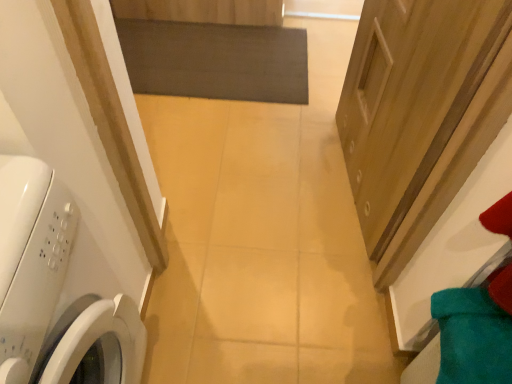
Question: From a real-world perspective, is dark gray matte mat at center below wooden door at right?

Choices:
 (A) yes
 (B) no

Answer: (A)

Question: From the image's perspective, does dark gray matte mat at center appear higher than wooden door at right?

Choices:
 (A) no
 (B) yes

Answer: (B)

Question: Considering the relative sizes of dark gray matte mat at center and wooden door at right in the image provided, is dark gray matte mat at center thinner than wooden door at right?

Choices:
 (A) no
 (B) yes

Answer: (A)

Question: Is dark gray matte mat at center aimed at wooden door at right?

Choices:
 (A) yes
 (B) no

Answer: (B)

Question: Is dark gray matte mat at center far from wooden door at right?

Choices:
 (A) yes
 (B) no

Answer: (B)

Question: Considering the positions of wooden door at right and white glossy washing machine at left in the image, is wooden door at right taller or shorter than white glossy washing machine at left?

Choices:
 (A) tall
 (B) short

Answer: (B)

Question: Is point coord(423,155) closer or farther from the camera than point coord(44,379)?

Choices:
 (A) closer
 (B) farther

Answer: (B)

Question: Based on their sizes in the image, would you say wooden door at right is bigger or smaller than white glossy washing machine at left?

Choices:
 (A) small
 (B) big

Answer: (A)

Question: Is wooden door at right to the left or to the right of white glossy washing machine at left in the image?

Choices:
 (A) right
 (B) left

Answer: (A)

Question: Is point (178, 34) positioned closer to the camera than point (435, 132)?

Choices:
 (A) farther
 (B) closer

Answer: (A)

Question: From a real-world perspective, is dark gray matte mat at center physically located above or below wooden door at right?

Choices:
 (A) above
 (B) below

Answer: (B)

Question: Considering their positions, is dark gray matte mat at center located in front of or behind wooden door at right?

Choices:
 (A) front
 (B) behind

Answer: (B)

Question: Is dark gray matte mat at center situated inside wooden door at right or outside?

Choices:
 (A) outside
 (B) inside

Answer: (A)

Question: In terms of size, does wooden door at right appear bigger or smaller than dark gray matte mat at center?

Choices:
 (A) small
 (B) big

Answer: (B)

Question: Is wooden door at right inside or outside of dark gray matte mat at center?

Choices:
 (A) outside
 (B) inside

Answer: (A)